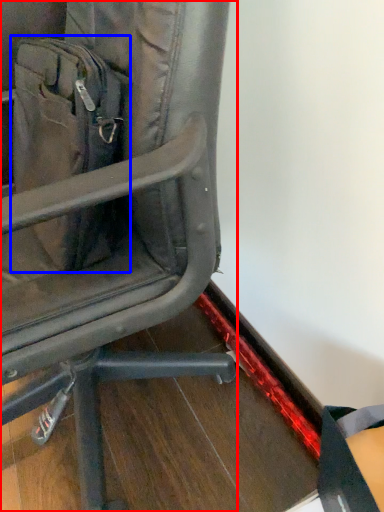
Question: Which object is closer to the camera taking this photo, chair (highlighted by a red box) or messenger bag (highlighted by a blue box)?

Choices:
 (A) chair
 (B) messenger bag

Answer: (A)